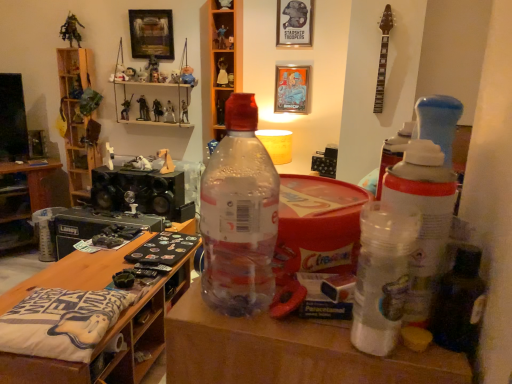
Question: Should I look upward or downward to see metallic green figure at upper left, which appears as the 18th toy when viewed from the right?

Choices:
 (A) up
 (B) down

Answer: (A)

Question: From the image's perspective, is metallic figure at shelf center, marked as the 8th toy in a left-to-right arrangement, located beneath white plastic figurine at upper center, arranged as the 5th toy when viewed from the right?

Choices:
 (A) no
 (B) yes

Answer: (B)

Question: Is metallic figure at shelf center, the eleventh toy positioned from the right, further to the viewer compared to white plastic figurine at upper center, positioned as the 14th toy in left-to-right order?

Choices:
 (A) no
 (B) yes

Answer: (B)

Question: Is metallic figure at shelf center, marked as the 8th toy in a left-to-right arrangement, to the left of white plastic figurine at upper center, positioned as the 14th toy in left-to-right order, from the viewer's perspective?

Choices:
 (A) no
 (B) yes

Answer: (B)

Question: From a real-world perspective, does metallic figure at shelf center, the eleventh toy positioned from the right, stand above white plastic figurine at upper center, arranged as the 5th toy when viewed from the right?

Choices:
 (A) no
 (B) yes

Answer: (A)

Question: Is metallic figure at shelf center, marked as the 8th toy in a left-to-right arrangement, wider than white plastic figurine at upper center, arranged as the 5th toy when viewed from the right?

Choices:
 (A) yes
 (B) no

Answer: (A)

Question: Would you say metallic figure at shelf center, the eleventh toy positioned from the right, is outside white plastic figurine at upper center, positioned as the 14th toy in left-to-right order?

Choices:
 (A) no
 (B) yes

Answer: (B)

Question: Is transparent plastic shelf at upper center, marked as the 1th shelf in a right-to-left arrangement, closer to the viewer compared to plush toy at upper center, the fourteenth toy viewed from the right?

Choices:
 (A) no
 (B) yes

Answer: (B)

Question: From the image's perspective, is transparent plastic shelf at upper center, marked as the 1th shelf in a right-to-left arrangement, below plush toy at upper center, the fourteenth toy viewed from the right?

Choices:
 (A) no
 (B) yes

Answer: (B)

Question: From a real-world perspective, does transparent plastic shelf at upper center, which is counted as the 2th shelf, starting from the left, stand above plush toy at upper center, the fifth toy viewed from the left?

Choices:
 (A) yes
 (B) no

Answer: (B)

Question: Does transparent plastic shelf at upper center, which is counted as the 2th shelf, starting from the left, have a greater height compared to plush toy at upper center, the fifth toy viewed from the left?

Choices:
 (A) no
 (B) yes

Answer: (B)

Question: From a real-world perspective, is transparent plastic shelf at upper center, which is counted as the 2th shelf, starting from the left, located beneath plush toy at upper center, the fourteenth toy viewed from the right?

Choices:
 (A) yes
 (B) no

Answer: (A)

Question: Considering the relative positions of transparent plastic shelf at upper center, marked as the 1th shelf in a right-to-left arrangement, and plush toy at upper center, the fourteenth toy viewed from the right, in the image provided, is transparent plastic shelf at upper center, marked as the 1th shelf in a right-to-left arrangement, to the left of plush toy at upper center, the fourteenth toy viewed from the right, from the viewer's perspective?

Choices:
 (A) yes
 (B) no

Answer: (B)

Question: From a real-world perspective, does plastic toy soldier at upper center, the eighteenth toy in the left-to-right sequence, stand above white plastic figurine at upper center, arranged as the 5th toy when viewed from the right?

Choices:
 (A) no
 (B) yes

Answer: (B)